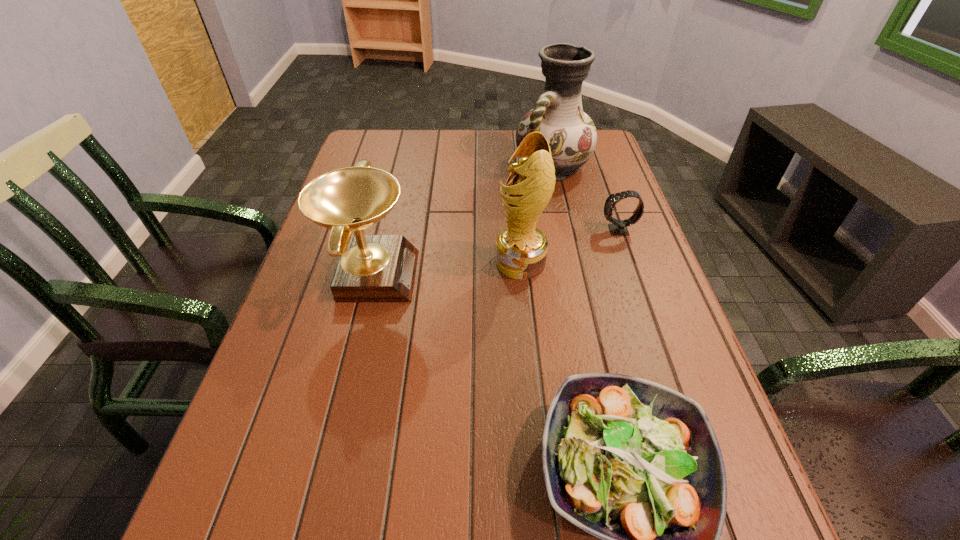
Identify the location of free location located 0.130m on the face of the watch. (550, 231).

At what (x,y) coordinates should I click in order to perform the action: click on free location located 0.070m on the face of the watch. Please return your answer as a coordinate pair (x, y). This screenshot has width=960, height=540. Looking at the image, I should click on (573, 231).

Identify the location of free space located on the face of the watch. This screenshot has height=540, width=960. (453, 231).

Identify the location of object positioned at the far edge. tap(558, 114).

In order to click on object that is at the left edge in this screenshot , I will do `click(371, 268)`.

Identify the location of vase that is at the right edge. (558, 114).

At what (x,y) coordinates should I click in order to perform the action: click on watch located in the right edge section of the desktop. Please return your answer as a coordinate pair (x, y). Looking at the image, I should click on (618, 227).

This screenshot has height=540, width=960. Find the location of `object at the far right corner`. object at the far right corner is located at coordinates (558, 114).

The height and width of the screenshot is (540, 960). What are the coordinates of `free space at the far edge` in the screenshot? It's located at (506, 150).

You are a GUI agent. You are given a task and a screenshot of the screen. Output one action in this format:
    pyautogui.click(x=<x>, y=<y>)
    Task: Click on the free space at the left edge of the desktop
    The image size is (960, 540).
    Given the screenshot: What is the action you would take?
    pyautogui.click(x=336, y=306)